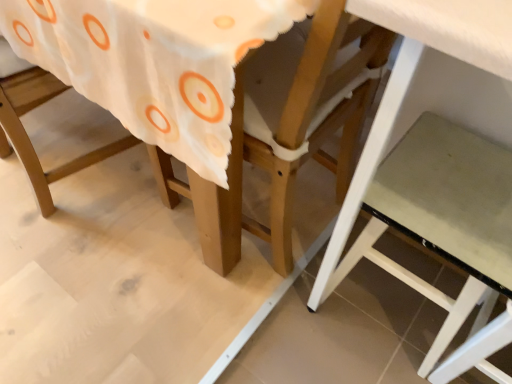
Locate an element on the screen. This screenshot has height=384, width=512. free spot above white matte step stool at lower right (from a real-world perspective) is located at coordinates (457, 195).